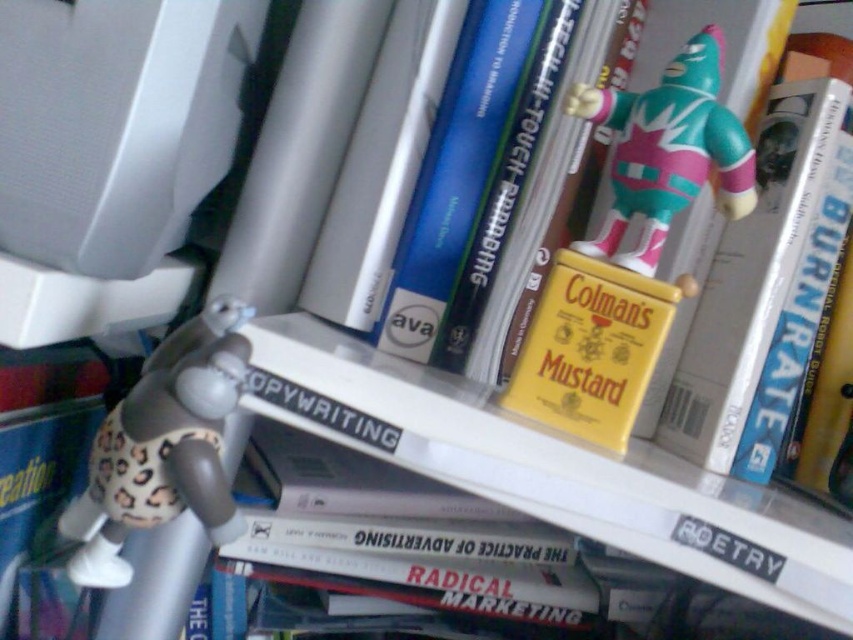
Between teal and pink plastic figure at upper right and yellow matte mustard container at center, which one is positioned higher?

Positioned higher is teal and pink plastic figure at upper right.

Between teal and pink plastic figure at upper right and yellow matte mustard container at center, which one has less height?

With less height is yellow matte mustard container at center.

Who is more distant from viewer, (x=697, y=67) or (x=576, y=323)?

Point (x=576, y=323)

Where is `teal and pink plastic figure at upper right`? teal and pink plastic figure at upper right is located at coordinates (666, 150).

Consider the image. Which of these two, leopard print fabric monkey at lower left or yellow matte mustard container at center, stands taller?

leopard print fabric monkey at lower left is taller.

Find the location of a particular element. leopard print fabric monkey at lower left is located at coordinates point(163,448).

Image resolution: width=853 pixels, height=640 pixels. What are the coordinates of `leopard print fabric monkey at lower left` in the screenshot? It's located at (163, 448).

Identify the location of leopard print fabric monkey at lower left. (163, 448).

Measure the distance from yellow matte mustard container at upper right to leopard print fabric monkey at lower left.

A distance of 12.86 inches exists between yellow matte mustard container at upper right and leopard print fabric monkey at lower left.

Which of these two, yellow matte mustard container at upper right or leopard print fabric monkey at lower left, stands taller?

With more height is yellow matte mustard container at upper right.

Image resolution: width=853 pixels, height=640 pixels. What do you see at coordinates (764, 289) in the screenshot? I see `yellow matte mustard container at upper right` at bounding box center [764, 289].

Identify the location of yellow matte mustard container at upper right. Image resolution: width=853 pixels, height=640 pixels. pos(764,289).